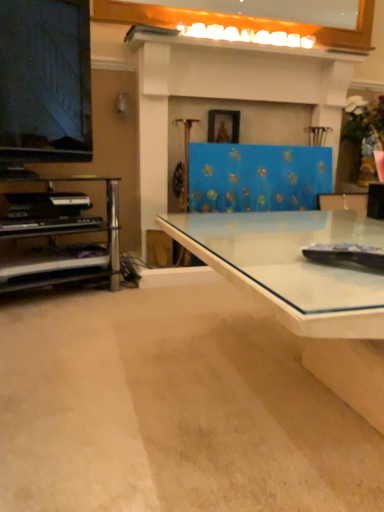
The image size is (384, 512). Identify the location of vacant area that is in front of metallic silver shelf at left. (61, 324).